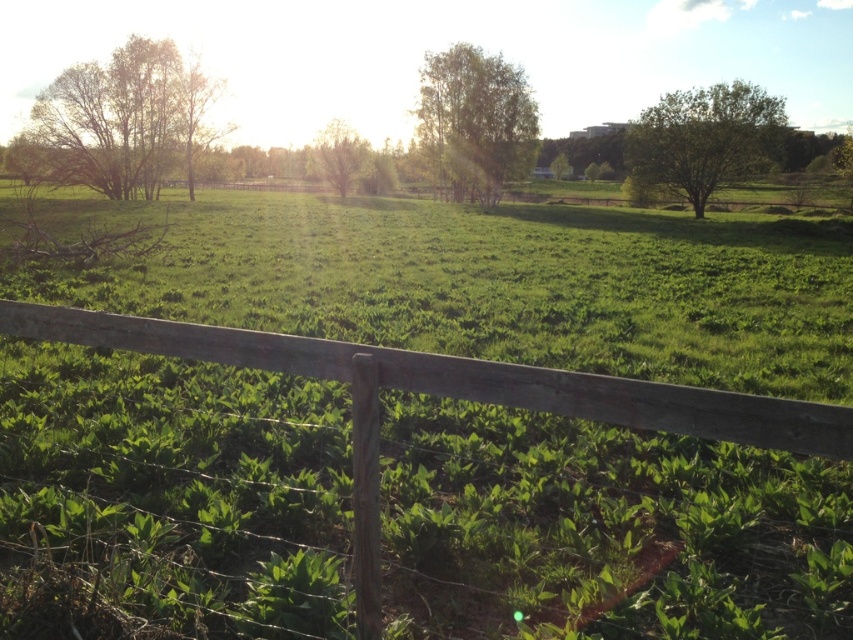
You are standing at the edge of the rural landscape and want to take a photo of both the weathered wood fence at lower center and the green leafy tree at upper center. Which object should you adjust your camera angle to focus on first to ensure both are in the frame?

You should focus on the weathered wood fence at lower center first because it is positioned on the left side of the green leafy tree at upper center, so adjusting the camera angle to include the leftmost object ensures both are captured in the frame.

You are a landscape architect designing a garden path that needs to pass between the brown textured bush at upper left and the green leafy tree at upper right. Based on their heights, which one will cast a longer shadow in the afternoon sunlight?

The brown textured bush at upper left has a greater height compared to the green leafy tree at upper right, so it will cast a longer shadow in the afternoon sunlight.